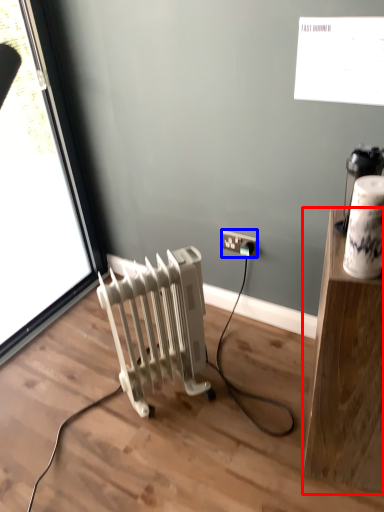
Question: Which object is closer to the camera taking this photo, furniture (highlighted by a red box) or power plugs and sockets (highlighted by a blue box)?

Choices:
 (A) furniture
 (B) power plugs and sockets

Answer: (A)